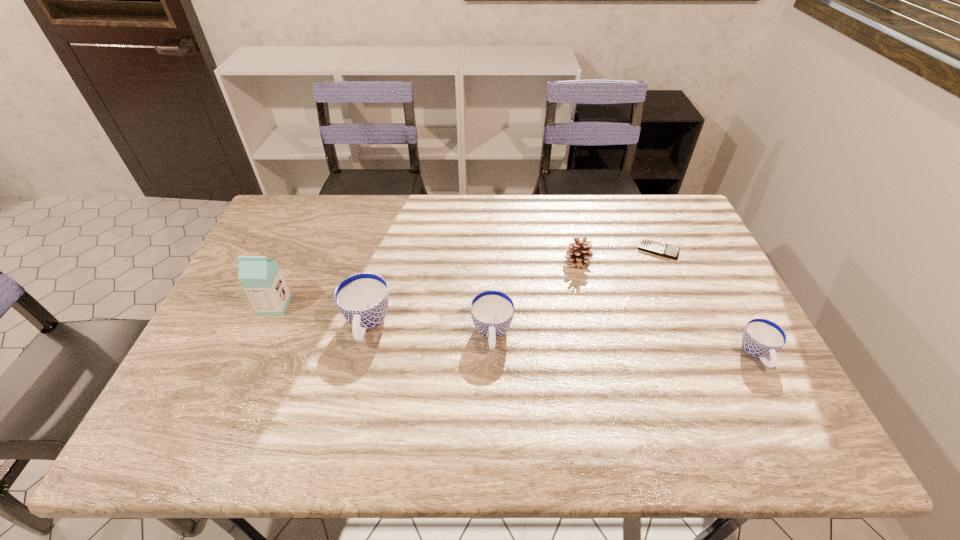
Image resolution: width=960 pixels, height=540 pixels. I want to click on the fourth object from left to right, so click(x=578, y=254).

Where is `vacant position located on the side of the leftmost cup with the handle`? This screenshot has width=960, height=540. vacant position located on the side of the leftmost cup with the handle is located at coordinates (352, 389).

This screenshot has width=960, height=540. Find the location of `free spot located 0.090m on the side of the fourth object from right to left with the handle`. free spot located 0.090m on the side of the fourth object from right to left with the handle is located at coordinates (493, 389).

I want to click on free space located 0.060m on the right of the calculator, so click(698, 250).

In order to click on free location located on the front of the tallest object in this screenshot , I will do `click(255, 351)`.

Locate an element on the screen. free location located on the left of the pinecone is located at coordinates (468, 261).

Locate an element on the screen. The image size is (960, 540). object that is at the left edge is located at coordinates (261, 278).

You are a GUI agent. You are given a task and a screenshot of the screen. Output one action in this format:
    pyautogui.click(x=<x>, y=<y>)
    Task: Click on the cup that is at the right edge
    The height and width of the screenshot is (540, 960).
    Given the screenshot: What is the action you would take?
    pyautogui.click(x=762, y=338)

What are the coordinates of `calculator positioned at the right edge` in the screenshot? It's located at (647, 245).

Find the location of a particular element. The height and width of the screenshot is (540, 960). vacant space at the far edge of the desktop is located at coordinates (612, 200).